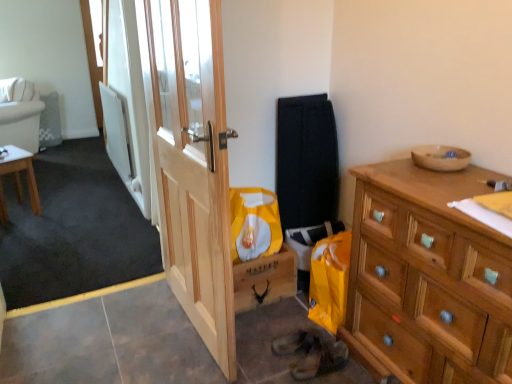
What is the approximate height of white fabric couch at upper left?

86.06 centimeters.

The width and height of the screenshot is (512, 384). What do you see at coordinates (440, 157) in the screenshot?
I see `wooden bowl at upper right` at bounding box center [440, 157].

Where is `leather shoe at lower center`? The image size is (512, 384). leather shoe at lower center is located at coordinates (320, 358).

From a real-world perspective, which object stands above the other?

wooden bowl at upper right.

Where is `pillow that is under the wooden bowl at upper right (from a real-world perspective)`? Image resolution: width=512 pixels, height=384 pixels. pillow that is under the wooden bowl at upper right (from a real-world perspective) is located at coordinates (16, 90).

Is wooden bowl at upper right a part of white fabric pillow at upper left?

No, wooden bowl at upper right is not surrounded by white fabric pillow at upper left.

Is leather shoe at lower center beside white fabric couch at upper left?

No, leather shoe at lower center is not beside white fabric couch at upper left.

From the image's perspective, is leather shoe at lower center under white fabric couch at upper left?

Yes, from the image's perspective, leather shoe at lower center is below white fabric couch at upper left.

What's the angular difference between leather shoe at lower center and white fabric couch at upper left's facing directions?

There is a 134-degree angle between the facing directions of leather shoe at lower center and white fabric couch at upper left.

Is wooden bowl at upper right positioned with its back to leather shoe at lower center?

wooden bowl at upper right is not turned away from leather shoe at lower center.

Between wooden bowl at upper right and leather shoe at lower center, which one is positioned behind?

leather shoe at lower center.

Is wooden bowl at upper right next to leather shoe at lower center?

wooden bowl at upper right and leather shoe at lower center are not in contact.

How far apart are wooden bowl at upper right and leather shoe at lower center?

They are 34.94 inches apart.

Is white fabric pillow at upper left not near natural wood door at center?

white fabric pillow at upper left is far away from natural wood door at center.

In the image, there is a white fabric pillow at upper left. At what (x,y) coordinates should I click in order to perform the action: click on door below it (from the image's perspective). Please return your answer as a coordinate pair (x, y). This screenshot has height=384, width=512. Looking at the image, I should click on [193, 166].

Is white fabric pillow at upper left located outside natural wood door at center?

Yes, white fabric pillow at upper left is located beyond the bounds of natural wood door at center.

Could you tell me if white fabric pillow at upper left is facing natural wood door at center?

No, white fabric pillow at upper left is not facing towards natural wood door at center.

Does wooden bowl at upper right have a lesser height compared to light brown wooden table at left?

Correct, wooden bowl at upper right is not as tall as light brown wooden table at left.

Find the location of `bowl above the light brown wooden table at left (from the image's perspective)`. bowl above the light brown wooden table at left (from the image's perspective) is located at coordinates (440, 157).

Between point (433, 166) and point (1, 186), which one is positioned behind?

The point (1, 186) is farther from the camera.

Does white fabric pillow at upper left have a smaller size compared to white fabric couch at upper left?

Indeed, white fabric pillow at upper left has a smaller size compared to white fabric couch at upper left.

Which object is positioned more to the left, white fabric pillow at upper left or white fabric couch at upper left?

Positioned to the left is white fabric couch at upper left.

From the image's perspective, is white fabric pillow at upper left located above white fabric couch at upper left?

Yes, from the image's perspective, white fabric pillow at upper left is above white fabric couch at upper left.

Which object is wider, white fabric pillow at upper left or white fabric couch at upper left?

white fabric couch at upper left is wider.

Considering the relative sizes of leather shoe at lower center and natural wood door at center in the image provided, is leather shoe at lower center bigger than natural wood door at center?

Incorrect, leather shoe at lower center is not larger than natural wood door at center.

From the image's perspective, who appears lower, leather shoe at lower center or natural wood door at center?

leather shoe at lower center appears lower in the image.

You are a GUI agent. You are given a task and a screenshot of the screen. Output one action in this format:
    pyautogui.click(x=<x>, y=<y>)
    Task: Click on the shoe lying behind the natural wood door at center
    
    Given the screenshot: What is the action you would take?
    pyautogui.click(x=320, y=358)

Which object is closer to the camera taking this photo, leather shoe at lower center or natural wood door at center?

natural wood door at center is more forward.

Where is `bowl lying below the white fabric pillow at upper left (from the image's perspective)`? This screenshot has width=512, height=384. bowl lying below the white fabric pillow at upper left (from the image's perspective) is located at coordinates (440, 157).

Where is `studio couch behind the leather shoe at lower center`? studio couch behind the leather shoe at lower center is located at coordinates (20, 115).

Looking at the image, which one is located closer to leather shoe at lower center, wooden dresser at right or white fabric pillow at upper left?

Based on the image, wooden dresser at right appears to be nearer to leather shoe at lower center.

From the image, which object appears to be nearer to white fabric pillow at upper left, white fabric couch at upper left or natural wood door at center?

The object closer to white fabric pillow at upper left is white fabric couch at upper left.

Looking at this image, looking at the image, which one is located further to light brown wooden table at left, natural wood door at center or wooden bowl at upper right?

wooden bowl at upper right is further to light brown wooden table at left.

Based on their spatial positions, is natural wood door at center or white fabric couch at upper left further from white fabric pillow at upper left?

The object further to white fabric pillow at upper left is natural wood door at center.

Based on their spatial positions, is natural wood door at center or white fabric couch at upper left closer to leather shoe at lower center?

natural wood door at center.

From the image, which object appears to be farther from white fabric pillow at upper left, light brown wooden table at left or leather shoe at lower center?

Among the two, leather shoe at lower center is located further to white fabric pillow at upper left.

From the image, which object appears to be nearer to wooden bowl at upper right, natural wood door at center or white fabric couch at upper left?

natural wood door at center lies closer to wooden bowl at upper right than the other object.

Looking at the image, which one is located further to white fabric couch at upper left, wooden bowl at upper right or light brown wooden table at left?

wooden bowl at upper right is further to white fabric couch at upper left.

You are a GUI agent. You are given a task and a screenshot of the screen. Output one action in this format:
    pyautogui.click(x=<x>, y=<y>)
    Task: Click on the shoe between white fabric pillow at upper left and wooden bowl at upper right in the horizontal direction
    This screenshot has width=512, height=384.
    Given the screenshot: What is the action you would take?
    pyautogui.click(x=320, y=358)

Locate an element on the screen. shoe between light brown wooden table at left and wooden dresser at right is located at coordinates (320, 358).

At what (x,y) coordinates should I click in order to perform the action: click on bowl situated between natural wood door at center and wooden dresser at right from left to right. Please return your answer as a coordinate pair (x, y). Looking at the image, I should click on (440, 157).

Identify the location of shoe between light brown wooden table at left and wooden bowl at upper right from left to right. (320, 358).